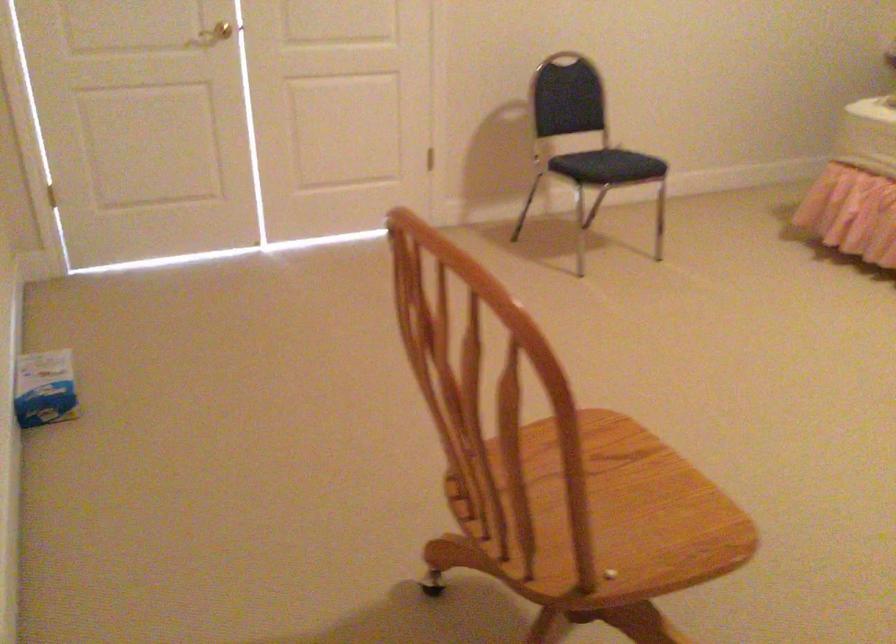
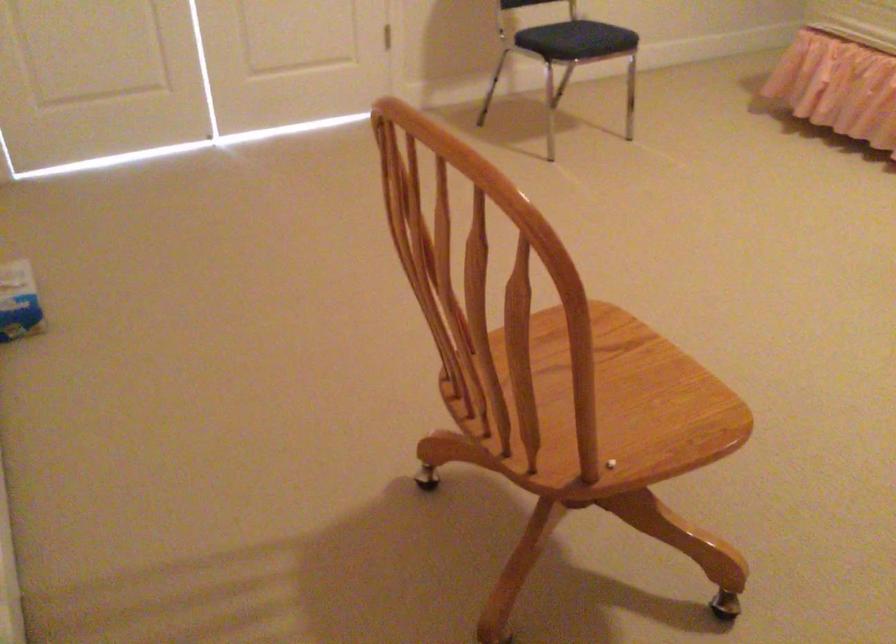
What movement of the cameraman would produce the second image?

The movement direction of the cameraman is left, forward.